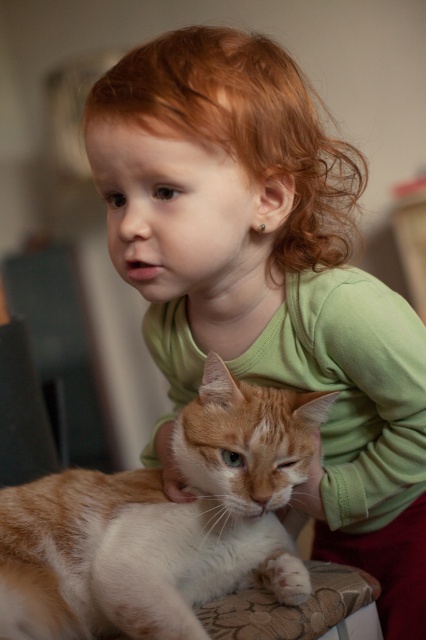
Which is behind, point (210, 369) or point (333, 218)?

The point (333, 218) is more distant.

Who is more distant from viewer, [124,525] or [158,48]?

The point [124,525] is behind.

You are a GUI agent. You are given a task and a screenshot of the screen. Output one action in this format:
    pyautogui.click(x=<x>, y=<y>)
    Task: Click on the orange-white fur cat at lower left
    This screenshot has height=640, width=426.
    Given the screenshot: What is the action you would take?
    pyautogui.click(x=158, y=522)

Where is `curly red hair at upper center`? curly red hair at upper center is located at coordinates (242, 129).

Which is behind, point (308, 264) or point (271, 563)?

The point (308, 264) is behind.

Between point (224, 116) and point (264, 566), which one is positioned behind?

Point (264, 566)

I want to click on curly red hair at upper center, so click(242, 129).

Is orange-white fur cat at lower left positioned behind white fluffy paw at lower center?

No, it is in front of white fluffy paw at lower center.

Is point (94, 522) positioned after point (275, 582)?

Yes.

Locate an element on the screen. The width and height of the screenshot is (426, 640). orange-white fur cat at lower left is located at coordinates (158, 522).